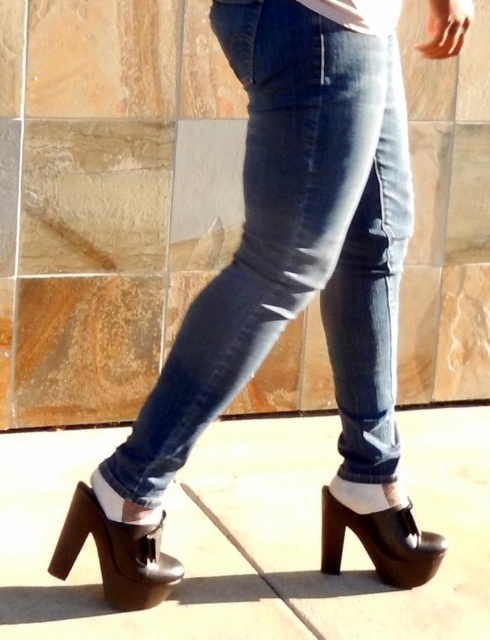
Question: Which object appears farthest from the camera in this image?

Choices:
 (A) denim at center
 (B) black leather sandal at lower center
 (C) black leather sandal at lower right

Answer: (C)

Question: Does denim at center have a greater width compared to black leather sandal at lower center?

Choices:
 (A) no
 (B) yes

Answer: (B)

Question: Does brown concrete pavement at lower center have a larger size compared to black leather sandal at lower right?

Choices:
 (A) yes
 (B) no

Answer: (A)

Question: Among these objects, which one is farthest from the camera?

Choices:
 (A) black leather sandal at lower right
 (B) black leather sandal at lower center

Answer: (A)

Question: From the image, what is the correct spatial relationship of denim at center in relation to black leather sandal at lower right?

Choices:
 (A) above
 (B) below

Answer: (A)

Question: Estimate the real-world distances between objects in this image. Which object is farther from the denim at center?

Choices:
 (A) brown concrete pavement at lower center
 (B) black leather sandal at lower right
 (C) black leather sandal at lower center

Answer: (A)